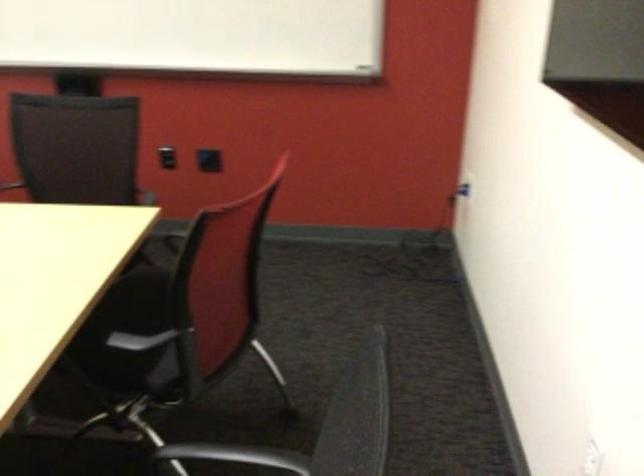
Find where to sit the black chair sitting surface. Please return your answer as a coordinate pair (x, y).

(140, 339)